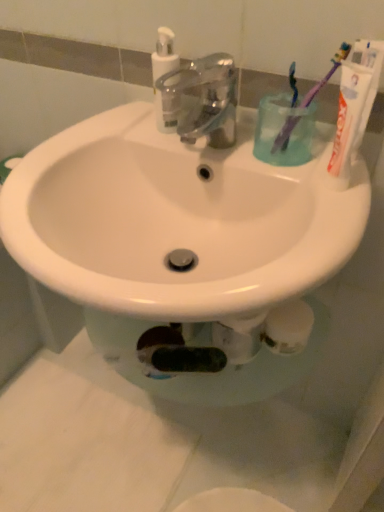
Image resolution: width=384 pixels, height=512 pixels. Identify the location of vacant area that lies between translucent plastic pump bottle at upper center and translucent plastic cup at upper right. (x=223, y=141).